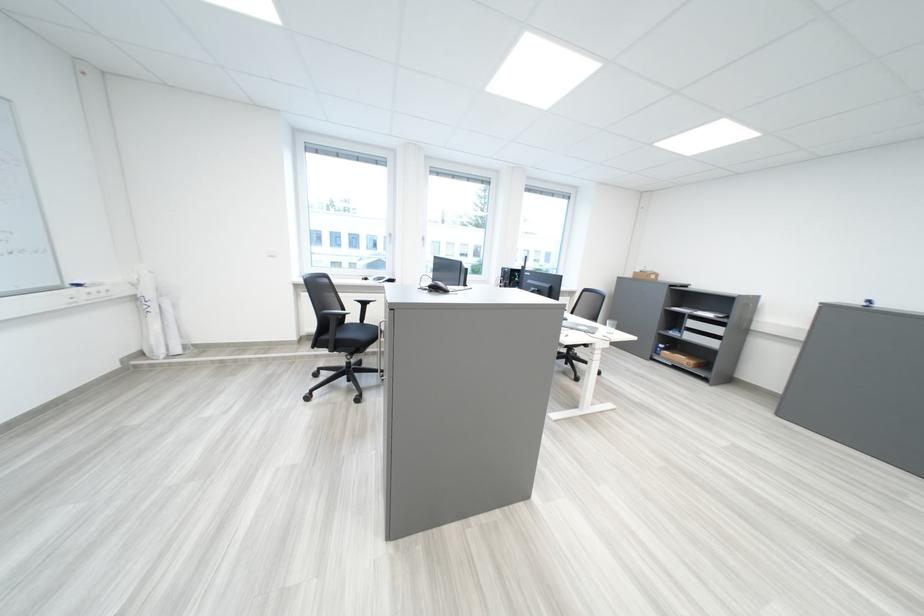
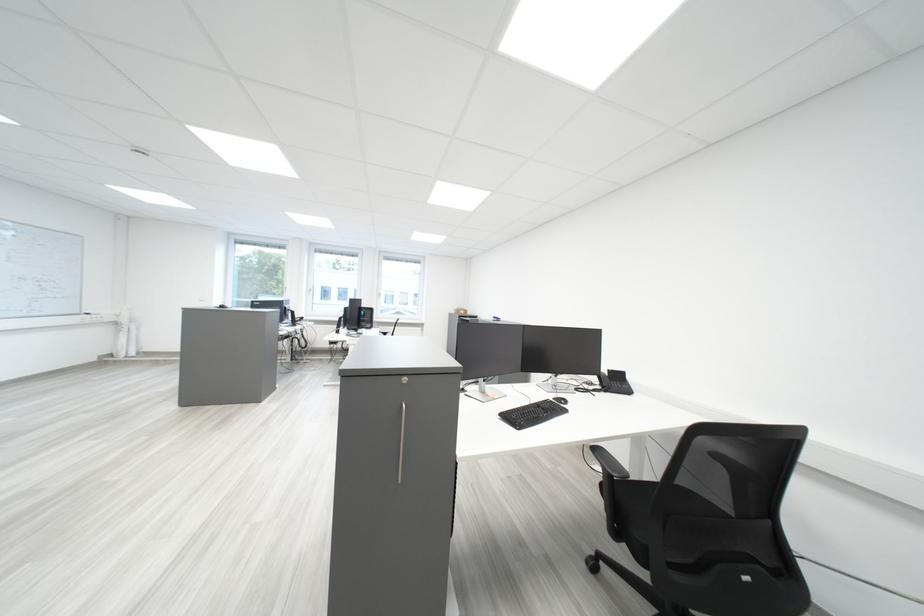
Question: I am providing you with two images of the same scene from different viewpoints. After the viewpoint changes to image2, which objects are now occluded?

Choices:
 (A) silver cabinet handle
 (B) white paper dispenser
 (C) chair armrest
 (D) grey computer mouse

Answer: (D)